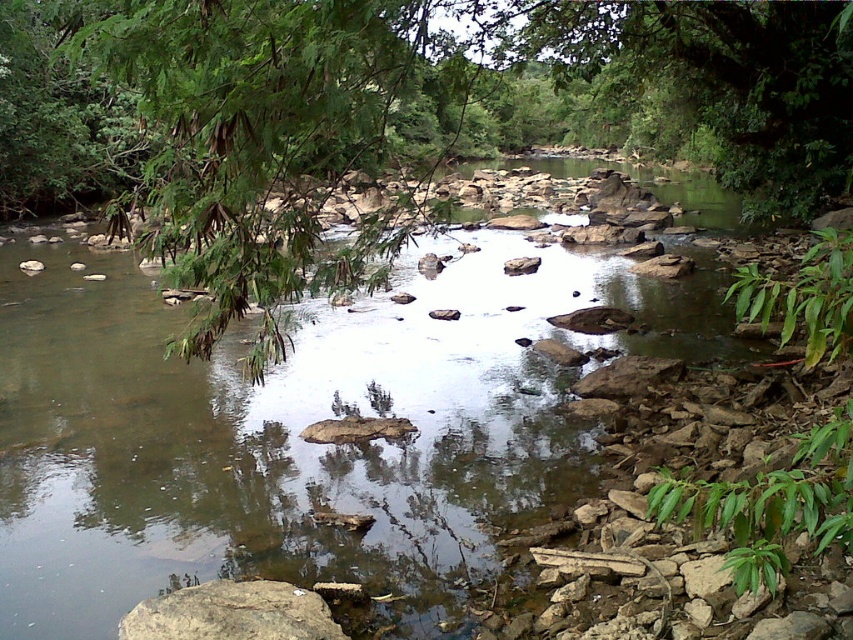
Question: Considering the relative positions of green leafy tree at upper left and brown rough rock at lower left in the image provided, where is green leafy tree at upper left located with respect to brown rough rock at lower left?

Choices:
 (A) below
 (B) above

Answer: (B)

Question: Which point is farther from the camera taking this photo?

Choices:
 (A) (193, 600)
 (B) (532, 128)
 (C) (97, 346)

Answer: (B)

Question: Which of the following is the farthest from the observer?

Choices:
 (A) green leafy tree at upper left
 (B) brown rough rock at lower left
 (C) brown rocky stream at center

Answer: (C)

Question: Which of these objects is positioned farthest from the brown rough rock at lower left?

Choices:
 (A) green leafy tree at upper left
 (B) brown rocky stream at center

Answer: (A)

Question: Is green leafy tree at upper left positioned behind brown rough rock at lower left?

Choices:
 (A) no
 (B) yes

Answer: (A)

Question: Does brown rocky stream at center have a smaller size compared to brown rough rock at lower left?

Choices:
 (A) yes
 (B) no

Answer: (B)